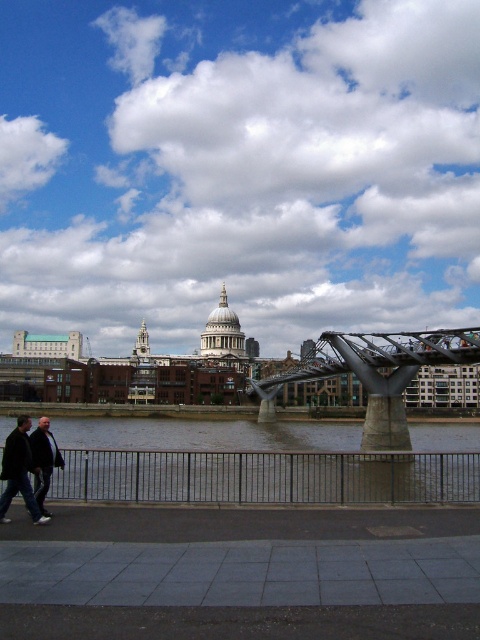
Question: Does dark gray concrete river at lower center have a smaller size compared to metallic gray bridge at center?

Choices:
 (A) yes
 (B) no

Answer: (B)

Question: Which point appears farthest from the camera in this image?

Choices:
 (A) (235, 428)
 (B) (348, 342)

Answer: (A)

Question: Which of these objects is positioned closest to the dark gray concrete river at lower center?

Choices:
 (A) dark gray jacket at lower left
 (B) white fluffy clouds at upper center
 (C) dark gray coat at lower left

Answer: (A)

Question: Among these points, which one is nearest to the camera?

Choices:
 (A) (40, 464)
 (B) (96, 237)
 (C) (14, 468)

Answer: (C)

Question: Does white fluffy clouds at upper center appear on the left side of dark gray coat at lower left?

Choices:
 (A) yes
 (B) no

Answer: (B)

Question: Where is metallic gray bridge at center located in relation to dark gray coat at lower left in the image?

Choices:
 (A) right
 (B) left

Answer: (A)